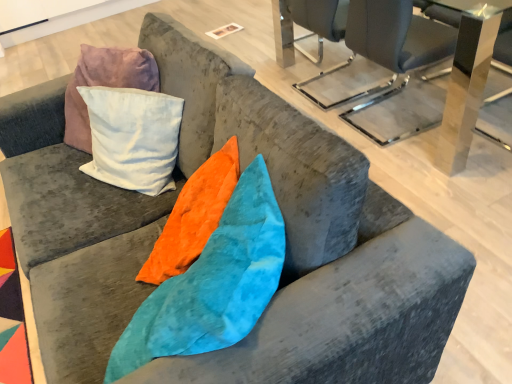
What do you see at coordinates (467, 78) in the screenshot? I see `transparent acrylic table at upper center, acting as the first table starting from the front` at bounding box center [467, 78].

Where is `metallic gray chair at upper right`? The height and width of the screenshot is (384, 512). metallic gray chair at upper right is located at coordinates (390, 41).

Image resolution: width=512 pixels, height=384 pixels. What do you see at coordinates (467, 77) in the screenshot?
I see `metallic glass table at upper right, the first table in the back-to-front sequence` at bounding box center [467, 77].

Locate an element on the screen. The height and width of the screenshot is (384, 512). transparent acrylic table at upper center, which is counted as the 2th table, starting from the back is located at coordinates (467, 78).

From a real-world perspective, is metallic glass table at upper right, placed as the 2th table when sorted from front to back, on metallic gray chair at upper right?

Actually, metallic glass table at upper right, placed as the 2th table when sorted from front to back, is physically below metallic gray chair at upper right in the real world.

Can you confirm if metallic glass table at upper right, the first table in the back-to-front sequence, is thinner than metallic gray chair at upper right?

Indeed, metallic glass table at upper right, the first table in the back-to-front sequence, has a lesser width compared to metallic gray chair at upper right.

Can you confirm if metallic glass table at upper right, placed as the 2th table when sorted from front to back, is bigger than metallic gray chair at upper right?

Incorrect, metallic glass table at upper right, placed as the 2th table when sorted from front to back, is not larger than metallic gray chair at upper right.

Considering the points (457, 119) and (380, 30), which point is behind, point (457, 119) or point (380, 30)?

The point (457, 119) is farther from the camera.

In terms of height, does metallic glass table at upper right, the first table in the back-to-front sequence, look taller or shorter compared to transparent acrylic table at upper center, which is counted as the 2th table, starting from the back?

In the image, metallic glass table at upper right, the first table in the back-to-front sequence, appears to be shorter than transparent acrylic table at upper center, which is counted as the 2th table, starting from the back.

Considering the positions of objects metallic glass table at upper right, placed as the 2th table when sorted from front to back, and transparent acrylic table at upper center, acting as the first table starting from the front, in the image provided, who is in front, metallic glass table at upper right, placed as the 2th table when sorted from front to back, or transparent acrylic table at upper center, acting as the first table starting from the front,?

transparent acrylic table at upper center, acting as the first table starting from the front.

Between metallic glass table at upper right, the first table in the back-to-front sequence, and transparent acrylic table at upper center, which is counted as the 2th table, starting from the back, which one appears on the right side from the viewer's perspective?

metallic glass table at upper right, the first table in the back-to-front sequence, is more to the right.

Identify the location of table on the left side of metallic glass table at upper right, placed as the 2th table when sorted from front to back. The image size is (512, 384). (467, 78).

Is metallic gray chair at upper right not inside metallic glass table at upper right, the first table in the back-to-front sequence?

Yes, metallic gray chair at upper right is located beyond the bounds of metallic glass table at upper right, the first table in the back-to-front sequence.

Looking at this image, from a real-world perspective, is metallic gray chair at upper right on metallic glass table at upper right, the first table in the back-to-front sequence?

Yes, from a real-world perspective, metallic gray chair at upper right is on top of metallic glass table at upper right, the first table in the back-to-front sequence.

Who is taller, metallic gray chair at upper right or metallic glass table at upper right, the first table in the back-to-front sequence?

Standing taller between the two is metallic gray chair at upper right.

Consider the image. From the image's perspective, relative to metallic glass table at upper right, the first table in the back-to-front sequence, is metallic gray chair at upper right above or below?

Clearly, from the image's perspective, metallic gray chair at upper right is above metallic glass table at upper right, the first table in the back-to-front sequence.

Which is in front, point (458, 5) or point (348, 21)?

The point (348, 21) is more forward.

From a real-world perspective, between transparent acrylic table at upper center, acting as the first table starting from the front, and metallic gray chair at upper right, who is vertically lower?

metallic gray chair at upper right, from a real-world perspective.

Is transparent acrylic table at upper center, which is counted as the 2th table, starting from the back, taller or shorter than metallic gray chair at upper right?

Clearly, transparent acrylic table at upper center, which is counted as the 2th table, starting from the back, is taller compared to metallic gray chair at upper right.

Considering the positions of objects transparent acrylic table at upper center, acting as the first table starting from the front, and metallic gray chair at upper right in the image provided, who is in front, transparent acrylic table at upper center, acting as the first table starting from the front, or metallic gray chair at upper right?

Positioned in front is transparent acrylic table at upper center, acting as the first table starting from the front.

Considering their positions, is metallic gray chair at upper right located in front of or behind transparent acrylic table at upper center, acting as the first table starting from the front?

Clearly, metallic gray chair at upper right is behind transparent acrylic table at upper center, acting as the first table starting from the front.

Is metallic gray chair at upper right looking in the opposite direction of transparent acrylic table at upper center, which is counted as the 2th table, starting from the back?

Yes.

Considering the points (355, 20) and (450, 106), which point is behind, point (355, 20) or point (450, 106)?

The point (450, 106) is farther.

Is transparent acrylic table at upper center, acting as the first table starting from the front, with metallic glass table at upper right, placed as the 2th table when sorted from front to back?

Yes, transparent acrylic table at upper center, acting as the first table starting from the front, is touching metallic glass table at upper right, placed as the 2th table when sorted from front to back.

What are the coordinates of `table above the metallic glass table at upper right, the first table in the back-to-front sequence (from a real-world perspective)` in the screenshot? It's located at (467, 78).

Which is farther from the camera, (x=466, y=140) or (x=487, y=18)?

The point (x=466, y=140) is more distant.

Considering the relative sizes of transparent acrylic table at upper center, which is counted as the 2th table, starting from the back, and metallic glass table at upper right, placed as the 2th table when sorted from front to back, in the image provided, is transparent acrylic table at upper center, which is counted as the 2th table, starting from the back, wider than metallic glass table at upper right, placed as the 2th table when sorted from front to back,?

Indeed, transparent acrylic table at upper center, which is counted as the 2th table, starting from the back, has a greater width compared to metallic glass table at upper right, placed as the 2th table when sorted from front to back.

I want to click on the 2nd table counting from the right of the metallic gray chair at upper right, so click(x=467, y=77).

Identify the location of table below the transparent acrylic table at upper center, which is counted as the 2th table, starting from the back (from a real-world perspective). (467, 77).

When comparing their distances from metallic glass table at upper right, placed as the 2th table when sorted from front to back, does metallic gray chair at upper right or transparent acrylic table at upper center, acting as the first table starting from the front, seem further?

The object further to metallic glass table at upper right, placed as the 2th table when sorted from front to back, is metallic gray chair at upper right.

Looking at the image, which one is located further to metallic glass table at upper right, placed as the 2th table when sorted from front to back, transparent acrylic table at upper center, which is counted as the 2th table, starting from the back, or metallic gray chair at upper right?

metallic gray chair at upper right is further to metallic glass table at upper right, placed as the 2th table when sorted from front to back.

When comparing their distances from transparent acrylic table at upper center, acting as the first table starting from the front, does metallic glass table at upper right, placed as the 2th table when sorted from front to back, or metallic gray chair at upper right seem further?

The object further to transparent acrylic table at upper center, acting as the first table starting from the front, is metallic gray chair at upper right.

Based on the photo, when comparing their distances from transparent acrylic table at upper center, which is counted as the 2th table, starting from the back, does metallic gray chair at upper right or metallic glass table at upper right, the first table in the back-to-front sequence, seem further?

metallic gray chair at upper right is positioned further to the anchor transparent acrylic table at upper center, which is counted as the 2th table, starting from the back.

When comparing their distances from metallic gray chair at upper right, does metallic glass table at upper right, the first table in the back-to-front sequence, or transparent acrylic table at upper center, which is counted as the 2th table, starting from the back, seem closer?

Based on the image, metallic glass table at upper right, the first table in the back-to-front sequence, appears to be nearer to metallic gray chair at upper right.

Which object lies nearer to the anchor point metallic gray chair at upper right, transparent acrylic table at upper center, acting as the first table starting from the front, or metallic glass table at upper right, placed as the 2th table when sorted from front to back?

metallic glass table at upper right, placed as the 2th table when sorted from front to back, is positioned closer to the anchor metallic gray chair at upper right.

Identify the location of table between metallic gray chair at upper right and metallic glass table at upper right, placed as the 2th table when sorted from front to back, from left to right. The image size is (512, 384). (467, 78).